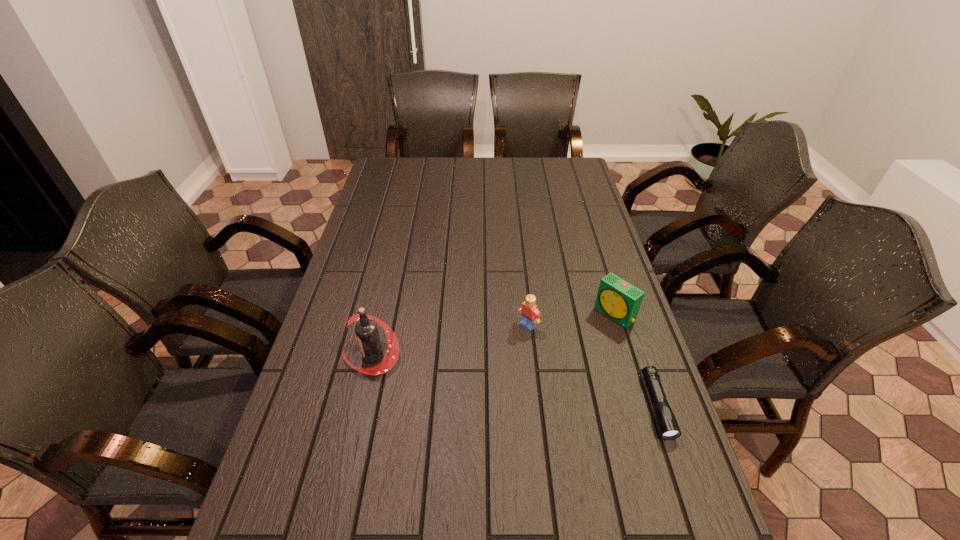
This screenshot has height=540, width=960. I want to click on blank space located on the front-facing side of the Lego, so click(x=449, y=388).

The image size is (960, 540). Find the location of `vacant space located on the front-facing side of the Lego`. vacant space located on the front-facing side of the Lego is located at coordinates (424, 408).

In order to click on free region located 0.270m on the front-facing side of the Lego in this screenshot , I will do point(449,388).

Identify the location of object present at the left edge. (366, 330).

Locate an element on the screen. This screenshot has height=540, width=960. flashlight that is at the right edge is located at coordinates (669, 429).

Find the location of a particular element. This screenshot has height=540, width=960. alarm clock that is at the right edge is located at coordinates (618, 299).

Where is `vacant space at the far edge of the desktop`? Image resolution: width=960 pixels, height=540 pixels. vacant space at the far edge of the desktop is located at coordinates (425, 178).

You are a GUI agent. You are given a task and a screenshot of the screen. Output one action in this format:
    pyautogui.click(x=<x>, y=<y>)
    Task: Click on the vacant space at the left edge
    This screenshot has width=960, height=540.
    Given the screenshot: What is the action you would take?
    pyautogui.click(x=404, y=205)

Locate an element on the screen. Image resolution: width=960 pixels, height=540 pixels. vacant area at the right edge is located at coordinates coord(594,233).

This screenshot has width=960, height=540. Find the location of `free space at the near right corner of the desktop`. free space at the near right corner of the desktop is located at coordinates (675, 535).